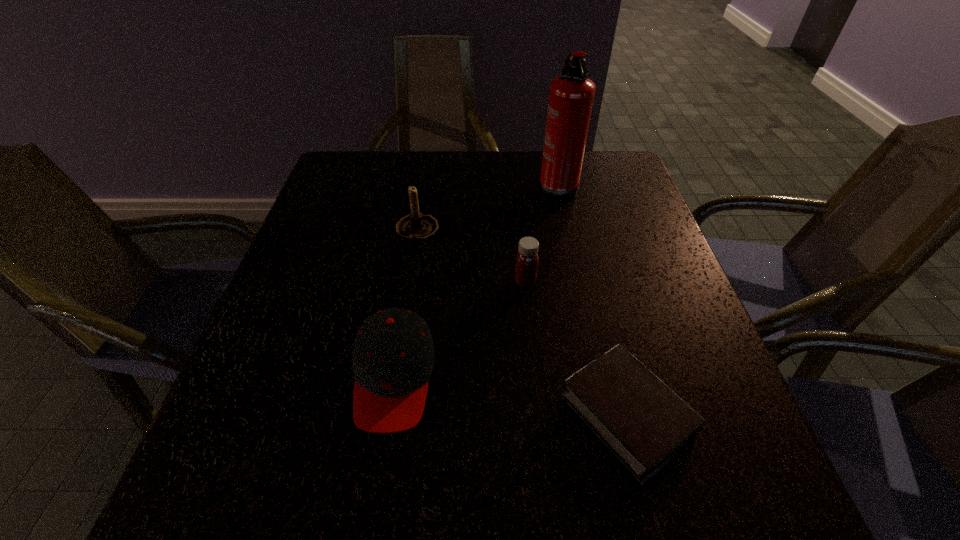
Locate an element on the screen. Image resolution: width=960 pixels, height=540 pixels. unoccupied area between the fourth shortest object and the tallest object is located at coordinates (487, 208).

Where is `empty location between the cap and the candle holder`? empty location between the cap and the candle holder is located at coordinates (405, 305).

Locate an element on the screen. The width and height of the screenshot is (960, 540). free spot between the medicine and the cap is located at coordinates (460, 329).

The image size is (960, 540). I want to click on vacant area between the fourth shortest object and the fire extinguisher, so click(x=487, y=208).

In order to click on free space between the third object from left to right and the farthest object in this screenshot , I will do `click(540, 233)`.

You are a GUI agent. You are given a task and a screenshot of the screen. Output one action in this format:
    pyautogui.click(x=<x>, y=<y>)
    Task: Click on the second closest object to the shortest object
    The width and height of the screenshot is (960, 540).
    Given the screenshot: What is the action you would take?
    pyautogui.click(x=393, y=355)

Choose which object is the nearest neighbor to the tallest object. Please provide its 2D coordinates. Your answer should be formatted as a tuple, i.e. [(x, y)], where the tuple contains the x and y coordinates of a point satisfying the conditions above.

[(527, 259)]

Find the location of a particular element. This screenshot has width=960, height=540. vacant position in the image that satisfies the following two spatial constraints: 1. at the nozzle of the tallest object; 2. on the front-facing side of the cap is located at coordinates (599, 377).

Identify the location of free space in the image that satisfies the following two spatial constraints: 1. at the nozzle of the fire extinguisher; 2. on the left side of the shortest object. (607, 415).

Find the location of `vacant point that satisfies the following two spatial constraints: 1. at the nozzle of the farthest object; 2. on the front-facing side of the cap`. vacant point that satisfies the following two spatial constraints: 1. at the nozzle of the farthest object; 2. on the front-facing side of the cap is located at coordinates (599, 377).